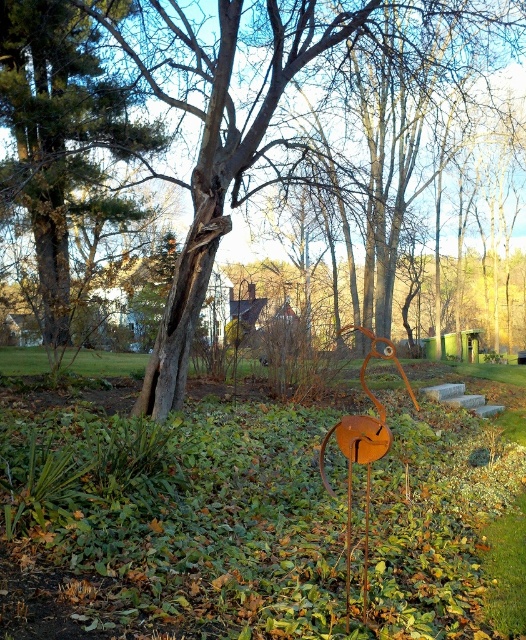
Question: In this image, where is green matte grass at center located relative to brown wood tree at center?

Choices:
 (A) below
 (B) above

Answer: (A)

Question: Estimate the real-world distances between objects in this image. Which object is farther from the brown wood tree at center?

Choices:
 (A) green matte grass at center
 (B) brown textured tree at upper left

Answer: (A)

Question: Is green matte grass at center positioned in front of brown textured tree at upper left?

Choices:
 (A) no
 (B) yes

Answer: (B)

Question: Which of these objects is positioned farthest from the brown textured tree at upper left?

Choices:
 (A) brown wood tree at center
 (B) green matte grass at center

Answer: (B)

Question: Can you confirm if brown wood tree at center is positioned below brown textured tree at upper left?

Choices:
 (A) no
 (B) yes

Answer: (B)

Question: Among these objects, which one is nearest to the camera?

Choices:
 (A) brown textured tree at upper left
 (B) brown wood tree at center

Answer: (B)